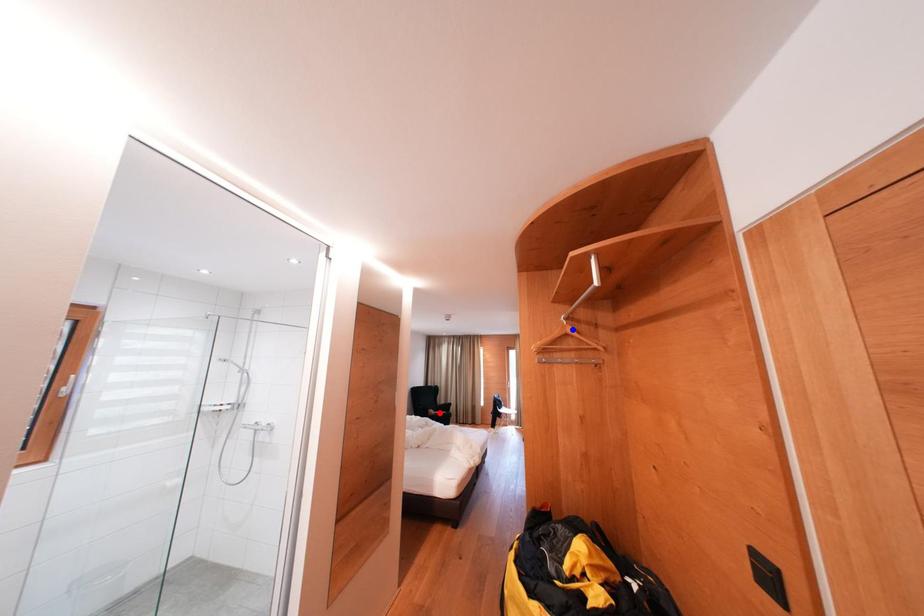
Question: Two points are marked on the image. Which point is closer to the camera?

Choices:
 (A) Blue point is closer.
 (B) Red point is closer.

Answer: (A)